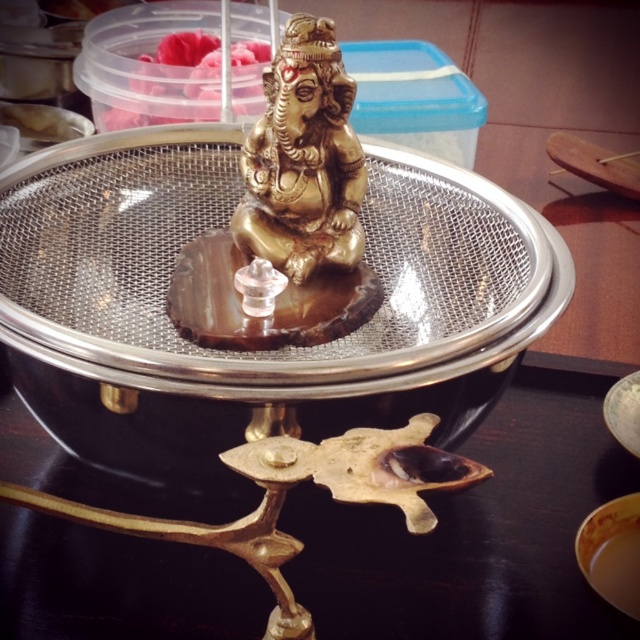
Can you confirm if gold polished statue at center is taller than pink soft food at center?

Yes.

Image resolution: width=640 pixels, height=640 pixels. What are the coordinates of `gold polished statue at center` in the screenshot? It's located at click(288, 216).

Is point (186, 257) more distant than point (168, 81)?

No.

The height and width of the screenshot is (640, 640). In order to click on gold polished statue at center in this screenshot , I will do `click(288, 216)`.

Measure the distance between metallic gold table at center and pink soft food at center.

metallic gold table at center is 26.65 inches from pink soft food at center.

Does point (76, 588) lie behind point (97, 90)?

No, (76, 588) is closer to viewer.

Does point (8, 588) lie in front of point (164, 93)?

Yes, it is in front of point (164, 93).

Find the location of a particular element. The width and height of the screenshot is (640, 640). metallic gold table at center is located at coordinates (476, 529).

Which is behind, point (618, 493) or point (280, 285)?

The point (618, 493) is more distant.

Which is below, metallic gold table at center or gold polished statue at center?

metallic gold table at center is below.

Identify the location of metallic gold table at center. (476, 529).

Locate an element on the screen. The image size is (640, 640). metallic gold table at center is located at coordinates (476, 529).